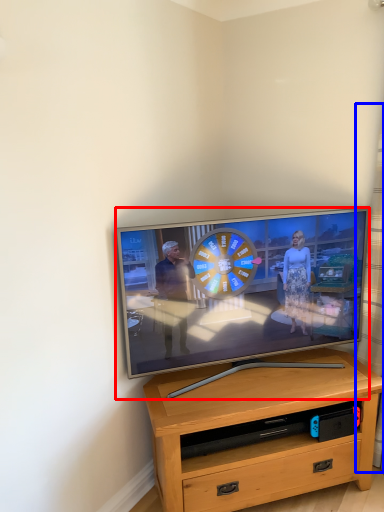
Question: Which of the following is the closest to the observer, television (highlighted by a red box) or curtain (highlighted by a blue box)?

Choices:
 (A) television
 (B) curtain

Answer: (B)